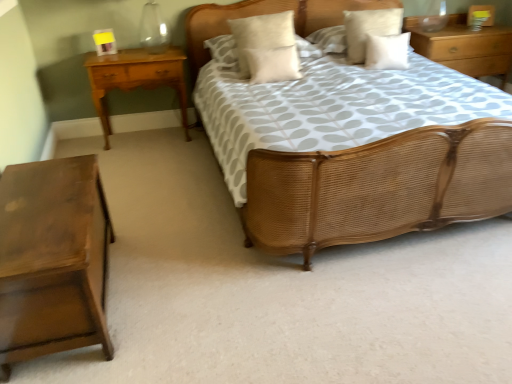
The width and height of the screenshot is (512, 384). What do you see at coordinates (465, 47) in the screenshot?
I see `wooden nightstand at upper right, placed as the 1th nightstand when sorted from right to left` at bounding box center [465, 47].

Locate an element on the screen. The width and height of the screenshot is (512, 384). white soft pillow at upper right, the fifth pillow when ordered from left to right is located at coordinates (387, 51).

In order to face white soft pillow at upper center, the 5th pillow positioned from the right, should I rotate leftwards or rightwards?

Turn right by 0.833 degrees to look at white soft pillow at upper center, the 5th pillow positioned from the right.

Where is `white soft cushion at center, the fourth pillow in the right-to-left sequence`? The image size is (512, 384). white soft cushion at center, the fourth pillow in the right-to-left sequence is located at coordinates (266, 47).

How much space does white soft cushion at center, which appears as the 2th pillow when viewed from the left, occupy horizontally?

white soft cushion at center, which appears as the 2th pillow when viewed from the left, is 17.88 centimeters wide.

Locate an element on the screen. The width and height of the screenshot is (512, 384). white soft pillow at center, the 3th pillow from the right is located at coordinates (273, 64).

Considering the relative sizes of white soft cushion at center, the fourth pillow in the right-to-left sequence, and dark brown wood nightstand at lower left, the 2th nightstand when ordered from left to right, in the image provided, is white soft cushion at center, the fourth pillow in the right-to-left sequence, wider than dark brown wood nightstand at lower left, the 2th nightstand when ordered from left to right,?

Incorrect, the width of white soft cushion at center, the fourth pillow in the right-to-left sequence, does not surpass that of dark brown wood nightstand at lower left, the 2th nightstand when ordered from left to right.

Choose the correct answer: Is white soft cushion at center, which appears as the 2th pillow when viewed from the left, inside dark brown wood nightstand at lower left, placed as the 1th nightstand when sorted from front to back, or outside it?

white soft cushion at center, which appears as the 2th pillow when viewed from the left, exists outside the volume of dark brown wood nightstand at lower left, placed as the 1th nightstand when sorted from front to back.

Does white soft cushion at center, the fourth pillow in the right-to-left sequence, have a lesser height compared to dark brown wood nightstand at lower left, acting as the 3th nightstand starting from the top?

Incorrect, the height of white soft cushion at center, the fourth pillow in the right-to-left sequence, does not fall short of that of dark brown wood nightstand at lower left, acting as the 3th nightstand starting from the top.

Which object is positioned more to the right, white soft pillow at upper right, the first pillow in the right-to-left sequence, or light brown wood nightstand at left, arranged as the second nightstand when viewed from the top?

From the viewer's perspective, white soft pillow at upper right, the first pillow in the right-to-left sequence, appears more on the right side.

Is white soft pillow at upper right, the fifth pillow when ordered from left to right, in contact with light brown wood nightstand at left, arranged as the second nightstand when viewed from the top?

white soft pillow at upper right, the fifth pillow when ordered from left to right, is not next to light brown wood nightstand at left, arranged as the second nightstand when viewed from the top, and they're not touching.

Does white soft pillow at upper right, the fifth pillow when ordered from left to right, have a larger size compared to light brown wood nightstand at left, marked as the 1th nightstand in a left-to-right arrangement?

Incorrect, white soft pillow at upper right, the fifth pillow when ordered from left to right, is not larger than light brown wood nightstand at left, marked as the 1th nightstand in a left-to-right arrangement.

Is white soft pillow at upper right, the first pillow in the right-to-left sequence, oriented away from light brown wood nightstand at left, the 2th nightstand viewed from the back?

white soft pillow at upper right, the first pillow in the right-to-left sequence, is not turned away from light brown wood nightstand at left, the 2th nightstand viewed from the back.

Does white soft pillow at upper center, the 5th pillow positioned from the right, have a smaller size compared to light brown wood nightstand at left, which appears as the 2th nightstand when ordered from the bottom?

Indeed, white soft pillow at upper center, the 5th pillow positioned from the right, has a smaller size compared to light brown wood nightstand at left, which appears as the 2th nightstand when ordered from the bottom.

From a real-world perspective, is white soft pillow at upper center, the 5th pillow positioned from the right, under light brown wood nightstand at left, arranged as the second nightstand when viewed from the top?

Incorrect, from a real-world perspective, white soft pillow at upper center, the 5th pillow positioned from the right, is higher than light brown wood nightstand at left, arranged as the second nightstand when viewed from the top.

Between white soft pillow at upper center, positioned as the 1th pillow in left-to-right order, and light brown wood nightstand at left, marked as the 1th nightstand in a left-to-right arrangement, which one is positioned in front?

light brown wood nightstand at left, marked as the 1th nightstand in a left-to-right arrangement, is more forward.

In the scene shown: Can you tell me how much white soft pillow at upper center, the 5th pillow positioned from the right, and light brown wood nightstand at left, placed as the third nightstand when sorted from right to left, differ in facing direction?

1.57 degrees separate the facing orientations of white soft pillow at upper center, the 5th pillow positioned from the right, and light brown wood nightstand at left, placed as the third nightstand when sorted from right to left.

Between point (237, 39) and point (295, 66), which one is positioned in front?

Positioned in front is point (295, 66).

In order to click on pillow that is the 2nd one when counting upward from the white soft pillow at center, the 3th pillow from the right (from the image's perspective) in this screenshot , I will do `click(266, 47)`.

Is white soft cushion at center, which appears as the 2th pillow when viewed from the left, directly adjacent to white soft pillow at center, the 3th pillow from the right?

Yes, white soft cushion at center, which appears as the 2th pillow when viewed from the left, is with white soft pillow at center, the 3th pillow from the right.

From a real-world perspective, which object stands above the other?

wooden nightstand at upper right, placed as the 1th nightstand when sorted from right to left, from a real-world perspective.

From the image's perspective, is wooden nightstand at upper right, the 3th nightstand from the front, beneath dark brown wood nightstand at lower left, which is the first nightstand in bottom-to-top order?

No, from the image's perspective, wooden nightstand at upper right, the 3th nightstand from the front, is not beneath dark brown wood nightstand at lower left, which is the first nightstand in bottom-to-top order.

Does point (444, 64) come closer to viewer compared to point (86, 202)?

No, it is not.

Considering the relative positions of white cotton pillow at upper center, acting as the fourth pillow starting from the left, and white soft pillow at upper center, positioned as the 1th pillow in left-to-right order, in the image provided, is white cotton pillow at upper center, acting as the fourth pillow starting from the left, behind white soft pillow at upper center, positioned as the 1th pillow in left-to-right order,?

No, the depth of white cotton pillow at upper center, acting as the fourth pillow starting from the left, is less than that of white soft pillow at upper center, positioned as the 1th pillow in left-to-right order.

From a real-world perspective, between white cotton pillow at upper center, arranged as the second pillow when viewed from the right, and white soft pillow at upper center, positioned as the 1th pillow in left-to-right order, who is vertically lower?

In real-world perspective, white soft pillow at upper center, positioned as the 1th pillow in left-to-right order, is lower.

Looking at this image, is white cotton pillow at upper center, acting as the fourth pillow starting from the left, oriented towards white soft pillow at upper center, the 5th pillow positioned from the right?

No, white cotton pillow at upper center, acting as the fourth pillow starting from the left, is not turned towards white soft pillow at upper center, the 5th pillow positioned from the right.

Which of these two, white cotton pillow at upper center, arranged as the second pillow when viewed from the right, or white soft pillow at upper center, the 5th pillow positioned from the right, is smaller?

white cotton pillow at upper center, arranged as the second pillow when viewed from the right.

From the image's perspective, relative to wooden nightstand at upper right, the 3th nightstand from the front, is dark brown wood nightstand at lower left, placed as the 1th nightstand when sorted from front to back, above or below?

dark brown wood nightstand at lower left, placed as the 1th nightstand when sorted from front to back, is situated lower than wooden nightstand at upper right, the 3th nightstand from the front, in the image.

Between dark brown wood nightstand at lower left, which ranks as the 2th nightstand in right-to-left order, and wooden nightstand at upper right, placed as the 1th nightstand when sorted from right to left, which one appears on the right side from the viewer's perspective?

Positioned to the right is wooden nightstand at upper right, placed as the 1th nightstand when sorted from right to left.

Is dark brown wood nightstand at lower left, which ranks as the 2th nightstand in right-to-left order, shorter than wooden nightstand at upper right, the 3th nightstand from the front?

Yes, dark brown wood nightstand at lower left, which ranks as the 2th nightstand in right-to-left order, is shorter than wooden nightstand at upper right, the 3th nightstand from the front.

Who is smaller, dark brown wood nightstand at lower left, the 2th nightstand when ordered from left to right, or wooden nightstand at upper right, the 3th nightstand in the bottom-to-top sequence?

With smaller size is dark brown wood nightstand at lower left, the 2th nightstand when ordered from left to right.

The width and height of the screenshot is (512, 384). Identify the location of pillow that is the 5th object above the dark brown wood nightstand at lower left, the 2th nightstand when ordered from left to right (from a real-world perspective). (266, 47).

From the image's perspective, count 2nd pillows upward from the light brown wood nightstand at left, marked as the 1th nightstand in a left-to-right arrangement, and point to it. Please provide its 2D coordinates.

[(387, 51)]

When comparing their distances from wooden nightstand at upper right, placed as the 1th nightstand when sorted from back to front, does white cotton pillow at upper center, acting as the fourth pillow starting from the left, or woven wood bed at center seem closer?

white cotton pillow at upper center, acting as the fourth pillow starting from the left, is positioned closer to the anchor wooden nightstand at upper right, placed as the 1th nightstand when sorted from back to front.

From the image, which object appears to be nearer to woven wood bed at center, wooden nightstand at upper right, the 3th nightstand from the left, or light brown wood nightstand at left, marked as the 1th nightstand in a left-to-right arrangement?

light brown wood nightstand at left, marked as the 1th nightstand in a left-to-right arrangement.

Looking at the image, which one is located closer to white soft pillow at center, which is the third pillow from left to right, white soft pillow at upper right, the fifth pillow when ordered from left to right, or white soft cushion at center, the fourth pillow in the right-to-left sequence?

white soft cushion at center, the fourth pillow in the right-to-left sequence, is positioned closer to the anchor white soft pillow at center, which is the third pillow from left to right.

Considering their positions, is white soft pillow at center, the 3th pillow from the right, positioned further to dark brown wood nightstand at lower left, which is the first nightstand in bottom-to-top order, than wooden nightstand at upper right, the 3th nightstand from the front?

Among the two, wooden nightstand at upper right, the 3th nightstand from the front, is located further to dark brown wood nightstand at lower left, which is the first nightstand in bottom-to-top order.

Based on their spatial positions, is white soft pillow at center, which is the third pillow from left to right, or woven wood bed at center closer to dark brown wood nightstand at lower left, placed as the 1th nightstand when sorted from front to back?

woven wood bed at center is closer to dark brown wood nightstand at lower left, placed as the 1th nightstand when sorted from front to back.

From the image, which object appears to be nearer to light brown wood nightstand at left, placed as the third nightstand when sorted from right to left, white cotton pillow at upper center, arranged as the second pillow when viewed from the right, or woven wood bed at center?

white cotton pillow at upper center, arranged as the second pillow when viewed from the right, is positioned closer to the anchor light brown wood nightstand at left, placed as the third nightstand when sorted from right to left.

Estimate the real-world distances between objects in this image. Which object is further from wooden nightstand at upper right, the 3th nightstand from the front, white cotton pillow at upper center, arranged as the second pillow when viewed from the right, or white soft cushion at center, the fourth pillow in the right-to-left sequence?

The object further to wooden nightstand at upper right, the 3th nightstand from the front, is white soft cushion at center, the fourth pillow in the right-to-left sequence.

Which object lies further to the anchor point white soft cushion at center, the fourth pillow in the right-to-left sequence, woven wood bed at center or white soft pillow at center, which is the third pillow from left to right?

The object further to white soft cushion at center, the fourth pillow in the right-to-left sequence, is woven wood bed at center.

I want to click on pillow between woven wood bed at center and white soft cushion at center, which appears as the 2th pillow when viewed from the left, along the z-axis, so click(273, 64).

You are a GUI agent. You are given a task and a screenshot of the screen. Output one action in this format:
    pyautogui.click(x=<x>, y=<y>)
    Task: Click on the pillow between white soft cushion at center, the fourth pillow in the right-to-left sequence, and white cotton pillow at upper center, acting as the fourth pillow starting from the left, from left to right
    This screenshot has height=384, width=512.
    Given the screenshot: What is the action you would take?
    pyautogui.click(x=273, y=64)

Image resolution: width=512 pixels, height=384 pixels. I want to click on pillow between dark brown wood nightstand at lower left, which is the first nightstand in bottom-to-top order, and white soft cushion at center, the fourth pillow in the right-to-left sequence, along the z-axis, so click(x=273, y=64).

You are a GUI agent. You are given a task and a screenshot of the screen. Output one action in this format:
    pyautogui.click(x=<x>, y=<y>)
    Task: Click on the bed situated between light brown wood nightstand at left, the 2th nightstand viewed from the back, and white soft pillow at upper right, the fifth pillow when ordered from left to right, from left to right
    The height and width of the screenshot is (384, 512).
    Given the screenshot: What is the action you would take?
    pyautogui.click(x=376, y=188)